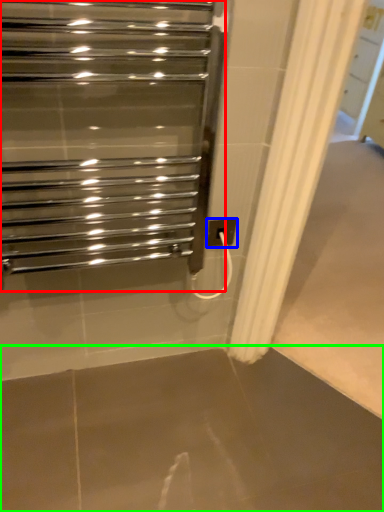
Question: Which object is the farthest from home appliance (highlighted by a red box)? Choose among these: electric outlet (highlighted by a blue box) or concrete (highlighted by a green box).

Choices:
 (A) electric outlet
 (B) concrete

Answer: (B)